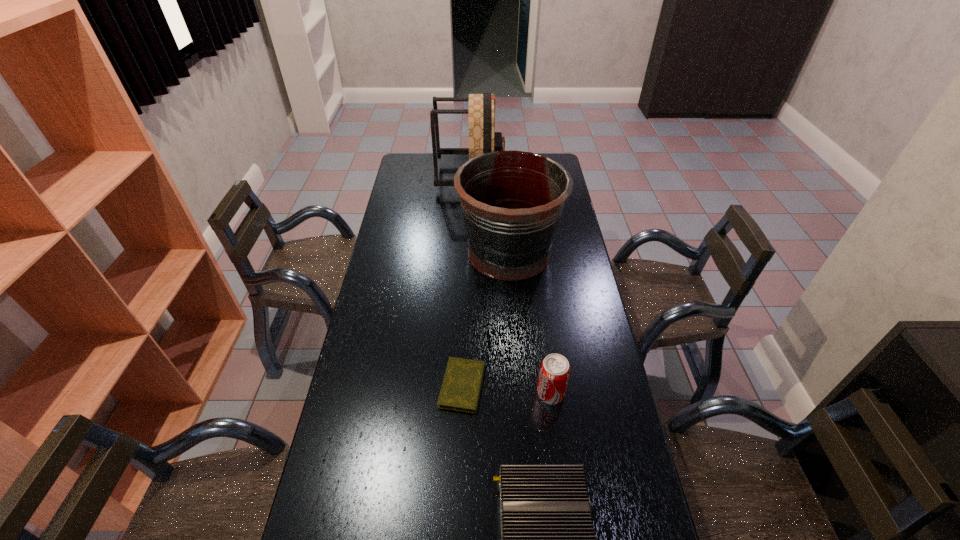
Locate an element on the screen. Image resolution: width=960 pixels, height=540 pixels. backpack is located at coordinates (483, 139).

This screenshot has height=540, width=960. Find the location of `the second tallest object`. the second tallest object is located at coordinates (511, 201).

The image size is (960, 540). In order to click on bucket in this screenshot , I will do pyautogui.click(x=511, y=201).

Locate an element on the screen. Image resolution: width=960 pixels, height=540 pixels. the third tallest object is located at coordinates (554, 373).

Where is `the shortest object`? The height and width of the screenshot is (540, 960). the shortest object is located at coordinates (460, 391).

Where is `vacant space situated on the front face of the backpack`? This screenshot has height=540, width=960. vacant space situated on the front face of the backpack is located at coordinates point(545,177).

The width and height of the screenshot is (960, 540). I want to click on free space located 0.290m on the back of the second farthest object, so click(504, 185).

I want to click on free space located on the back of the soda can, so click(x=541, y=323).

I want to click on free space located on the left of the shortest object, so pos(376,386).

The width and height of the screenshot is (960, 540). I want to click on object that is at the far edge, so click(483, 139).